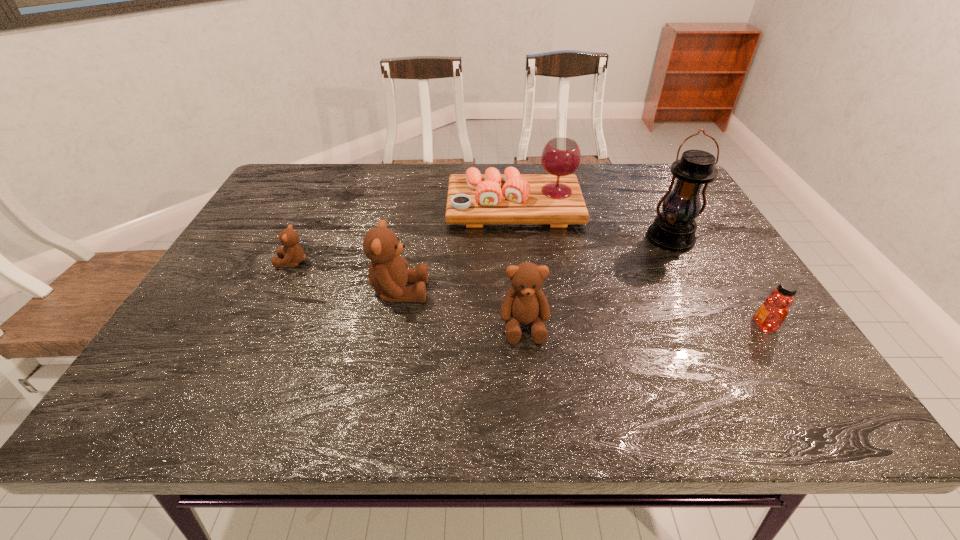
Where is `lantern that is at the right edge`? lantern that is at the right edge is located at coordinates (674, 229).

Where is `honey positioned at the right edge`? This screenshot has height=540, width=960. honey positioned at the right edge is located at coordinates (772, 313).

Locate an element on the screen. This screenshot has height=540, width=960. vacant region at the far edge of the desktop is located at coordinates (373, 194).

What are the coordinates of `free space at the near edge` in the screenshot? It's located at (422, 365).

Locate an element on the screen. This screenshot has height=540, width=960. free space at the left edge is located at coordinates (210, 303).

Where is `blank space at the right edge of the desktop`? This screenshot has width=960, height=540. blank space at the right edge of the desktop is located at coordinates (722, 275).

In the image, there is a desktop. In order to click on vacant space at the far right corner in this screenshot , I will do coord(657,204).

Find the location of a particular element. This screenshot has height=540, width=960. free area in between the second tallest teddy bear and the second teddy bear from right to left is located at coordinates (462, 308).

This screenshot has height=540, width=960. What are the coordinates of `empty space between the second tallest teddy bear and the fifth object from right to left` in the screenshot? It's located at (462, 308).

Image resolution: width=960 pixels, height=540 pixels. Find the location of `free spot between the shortest object and the platter`. free spot between the shortest object and the platter is located at coordinates (403, 235).